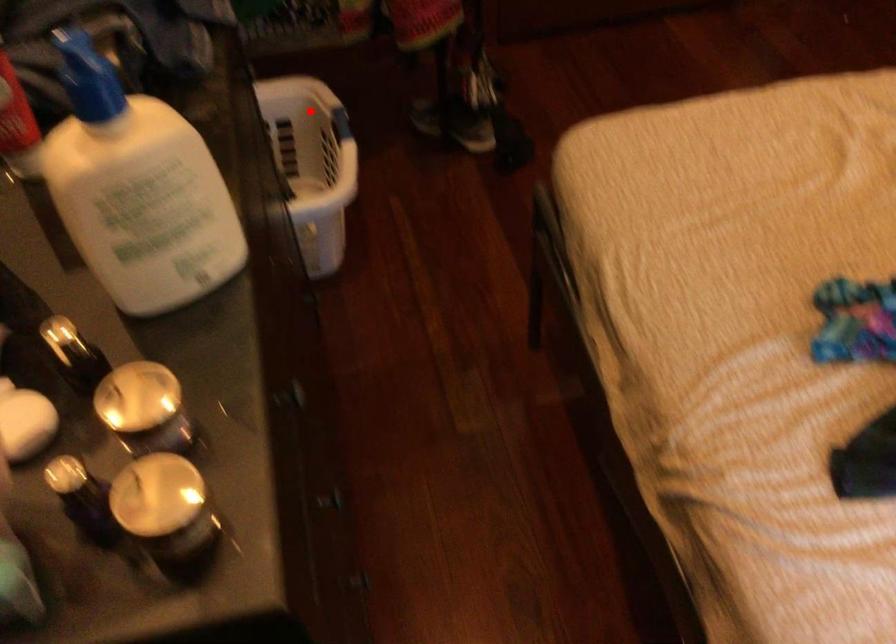
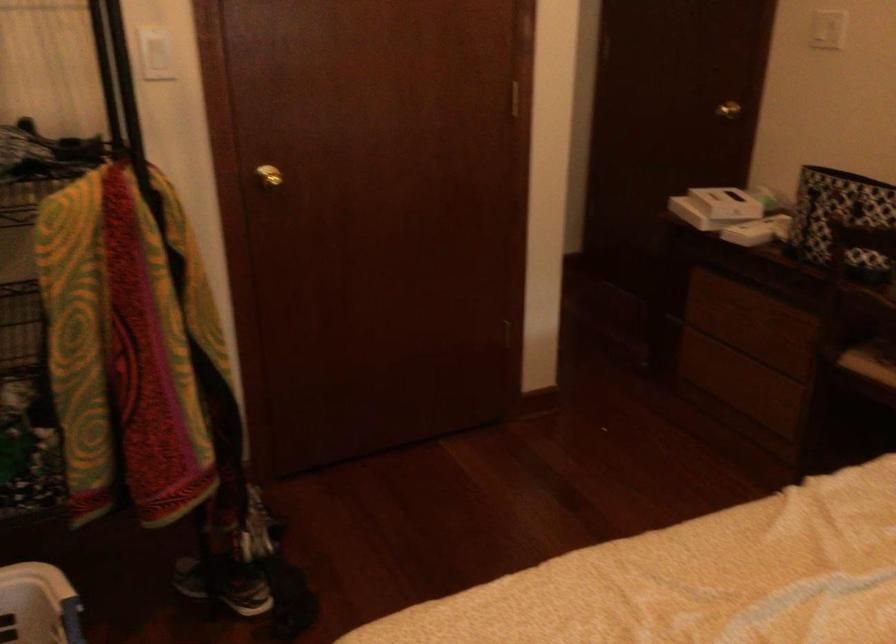
Question: A red point is marked in image1. In image2, is the corresponding 3D point closer to the camera or farther? Reply with the corresponding letter.

Choices:
 (A) The corresponding 3D point is closer.
 (B) The corresponding 3D point is farther.

Answer: (A)